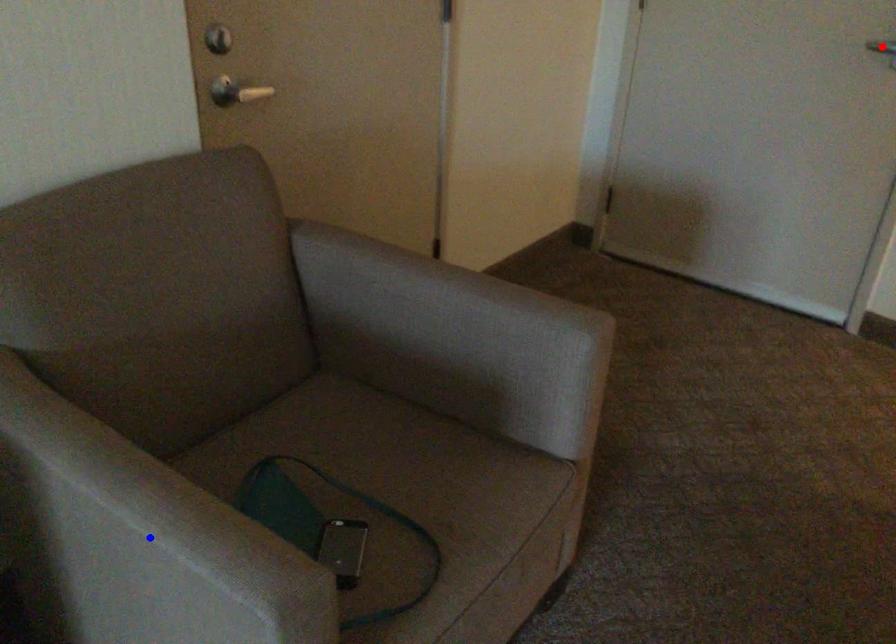
Question: Two points are marked on the image. Which point is closer to the camera?

Choices:
 (A) Blue point is closer.
 (B) Red point is closer.

Answer: (A)